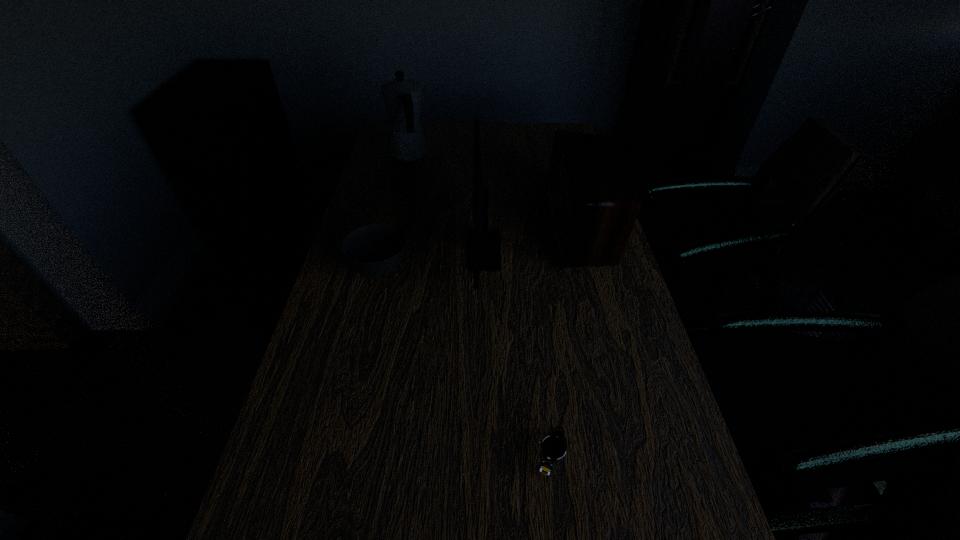
Locate an element on the screen. This screenshot has width=960, height=540. the farthest object is located at coordinates (402, 98).

The image size is (960, 540). I want to click on computer monitor, so click(x=485, y=255).

The height and width of the screenshot is (540, 960). I want to click on the third shortest object, so click(x=592, y=203).

At what (x,y) coordinates should I click in order to perform the action: click on radio receiver. Please return your answer as a coordinate pair (x, y). The height and width of the screenshot is (540, 960). Looking at the image, I should click on (592, 203).

Where is `bowl`? This screenshot has width=960, height=540. bowl is located at coordinates (375, 250).

The image size is (960, 540). I want to click on the fourth object from left to right, so click(553, 448).

Find the location of `the shortest object`. the shortest object is located at coordinates (553, 448).

The width and height of the screenshot is (960, 540). I want to click on blank space located on the right of the coffeepot, so click(522, 155).

Identify the location of vacant space situated 0.260m on the screen side of the computer monitor. The width and height of the screenshot is (960, 540). point(377,251).

The height and width of the screenshot is (540, 960). What are the coordinates of `vacant area located 0.060m on the screen side of the computer monitor` in the screenshot? It's located at (448, 251).